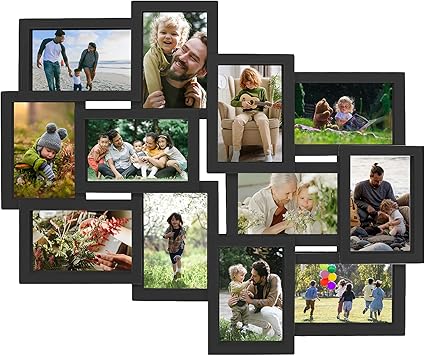
Identify the location of bottom row of photos. Image resolution: width=425 pixels, height=356 pixels. (83, 254), (251, 278), (318, 286), (190, 257), (89, 240).